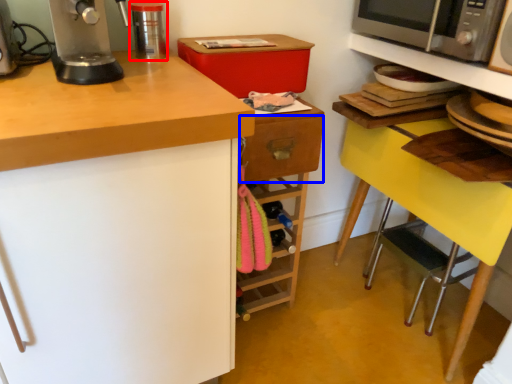
Question: Which of the following is the farthest to the observer, kitchen appliance (highlighted by a red box) or drawer (highlighted by a blue box)?

Choices:
 (A) kitchen appliance
 (B) drawer

Answer: (B)